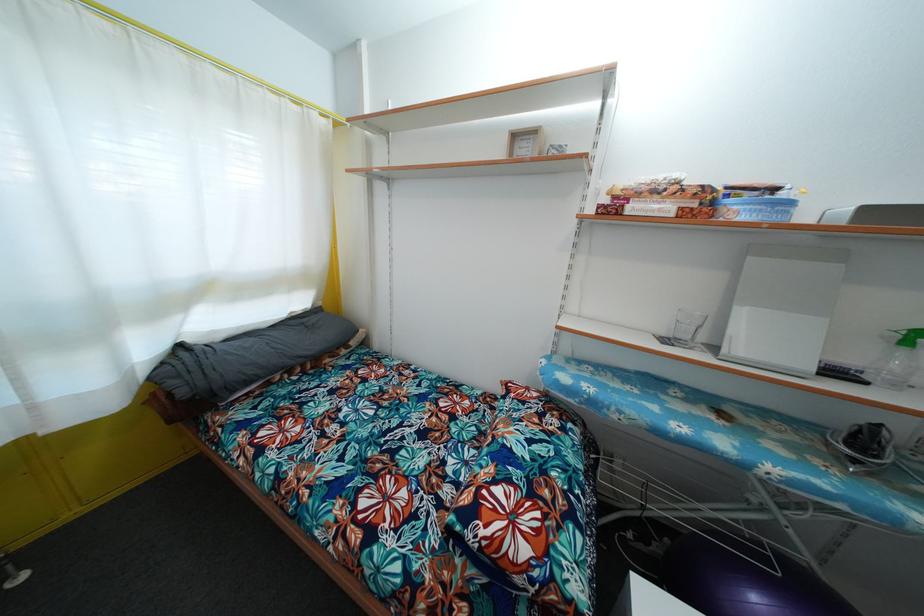
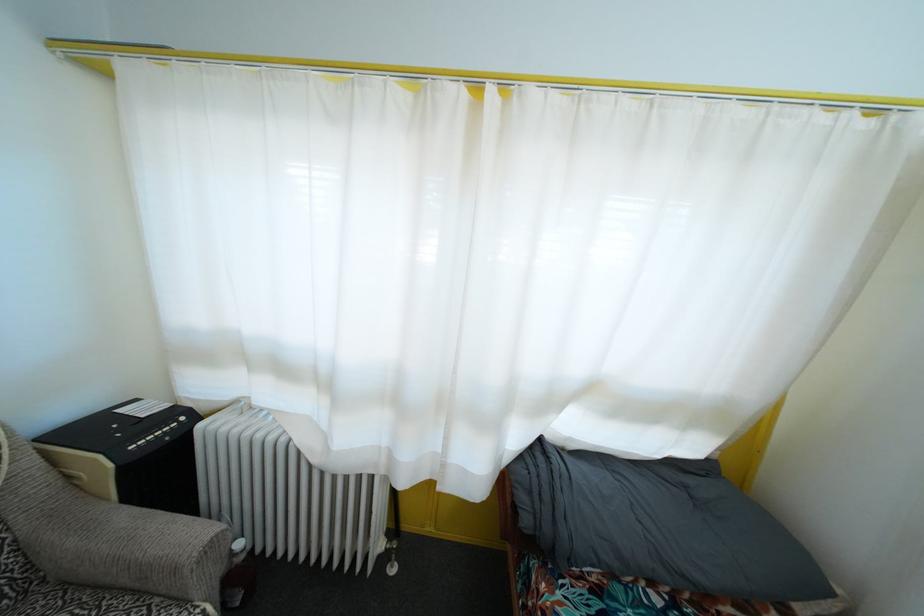
Question: How did the camera likely rotate?

Choices:
 (A) Left
 (B) Right
 (C) Up
 (D) Down

Answer: (A)